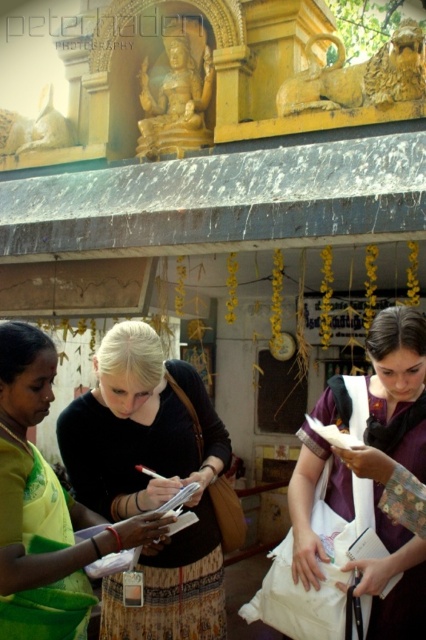
You are a visitor at the temple and notice two items at the center of the scene. Which item is positioned lower down between the black fabric skirt at center and the white fabric bag at center?

The black fabric skirt at center is located below the white fabric bag at center, so it is positioned lower down.

You are an observer at the temple scene. You notice two items at the center of the image. Which item is wider, the black fabric skirt at center or the white fabric bag at center?

The black fabric skirt at center is wider than the white fabric bag at center according to the description.

You are a photographer taking a picture of the temple scene. You need to focus on the black fabric skirt at center and the white fabric bag at center. Which object should you adjust your camera to the left to capture better?

The black fabric skirt at center is positioned on the left side of the white fabric bag at center. Therefore, to capture the black fabric skirt at center, you should adjust your camera to the left since it is already on the left side of the white fabric bag at center.